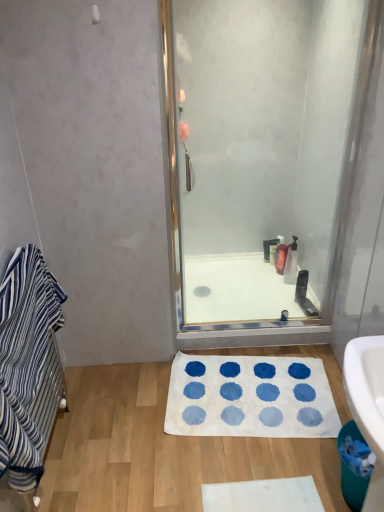
Question: Can you confirm if translucent plastic soap dispenser at center, arranged as the 2th toiletry when viewed from the back, is positioned to the left of translucent plastic soap dispenser at center, placed as the first toiletry when sorted from back to front?

Choices:
 (A) no
 (B) yes

Answer: (B)

Question: Is translucent plastic soap dispenser at center, arranged as the 2th toiletry when viewed from the back, positioned behind translucent plastic soap dispenser at center, placed as the first toiletry when sorted from back to front?

Choices:
 (A) no
 (B) yes

Answer: (A)

Question: Considering the relative sizes of translucent plastic soap dispenser at center, the third toiletry in the front-to-back sequence, and translucent plastic soap dispenser at center, placed as the 4th toiletry when sorted from front to back, in the image provided, is translucent plastic soap dispenser at center, the third toiletry in the front-to-back sequence, wider than translucent plastic soap dispenser at center, placed as the 4th toiletry when sorted from front to back,?

Choices:
 (A) no
 (B) yes

Answer: (B)

Question: Is translucent plastic soap dispenser at center, the third toiletry in the front-to-back sequence, facing towards translucent plastic soap dispenser at center, placed as the first toiletry when sorted from back to front?

Choices:
 (A) yes
 (B) no

Answer: (B)

Question: From a real-world perspective, is translucent plastic soap dispenser at center, arranged as the 2th toiletry when viewed from the back, located beneath translucent plastic soap dispenser at center, placed as the first toiletry when sorted from back to front?

Choices:
 (A) no
 (B) yes

Answer: (B)

Question: From a real-world perspective, is translucent plastic soap dispenser at center, the third toiletry in the front-to-back sequence, positioned over translucent plastic soap dispenser at center, placed as the first toiletry when sorted from back to front, based on gravity?

Choices:
 (A) yes
 (B) no

Answer: (B)

Question: Is translucent plastic bottle at upper right, which ranks as the third toiletry in back-to-front order, thinner than translucent plastic soap dispenser at center, placed as the 4th toiletry when sorted from front to back?

Choices:
 (A) yes
 (B) no

Answer: (B)

Question: Does translucent plastic bottle at upper right, marked as the second toiletry in a front-to-back arrangement, turn towards translucent plastic soap dispenser at center, placed as the 4th toiletry when sorted from front to back?

Choices:
 (A) no
 (B) yes

Answer: (A)

Question: Does translucent plastic bottle at upper right, which ranks as the third toiletry in back-to-front order, have a larger size compared to translucent plastic soap dispenser at center, placed as the 4th toiletry when sorted from front to back?

Choices:
 (A) no
 (B) yes

Answer: (B)

Question: Does translucent plastic bottle at upper right, marked as the second toiletry in a front-to-back arrangement, have a greater width compared to translucent plastic soap dispenser at center, placed as the 4th toiletry when sorted from front to back?

Choices:
 (A) no
 (B) yes

Answer: (B)

Question: Considering the relative sizes of translucent plastic bottle at upper right, which ranks as the third toiletry in back-to-front order, and translucent plastic soap dispenser at center, placed as the first toiletry when sorted from back to front, in the image provided, is translucent plastic bottle at upper right, which ranks as the third toiletry in back-to-front order, shorter than translucent plastic soap dispenser at center, placed as the first toiletry when sorted from back to front,?

Choices:
 (A) no
 (B) yes

Answer: (A)

Question: From the image's perspective, is translucent plastic bottle at upper right, which ranks as the third toiletry in back-to-front order, above translucent plastic soap dispenser at center, placed as the 4th toiletry when sorted from front to back?

Choices:
 (A) no
 (B) yes

Answer: (A)

Question: Is translucent plastic bottle at upper right, which ranks as the third toiletry in back-to-front order, at the right side of white soft bath mat at center?

Choices:
 (A) no
 (B) yes

Answer: (B)